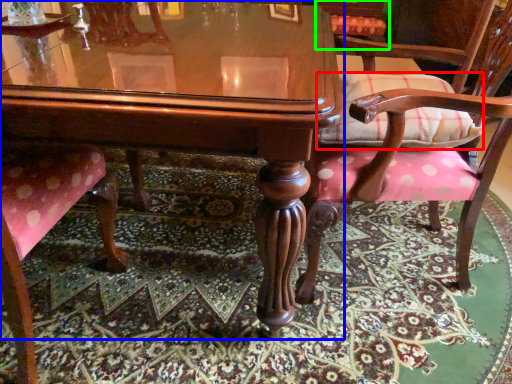
Question: Which object is positioned farthest from pillow (highlighted by a red box)? Select from table (highlighted by a blue box) and chair (highlighted by a green box).

Choices:
 (A) table
 (B) chair

Answer: (B)